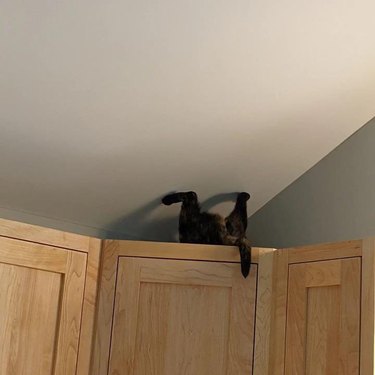
This screenshot has width=375, height=375. Find the location of `reflection on cabinet`. reflection on cabinet is located at coordinates (270, 251).